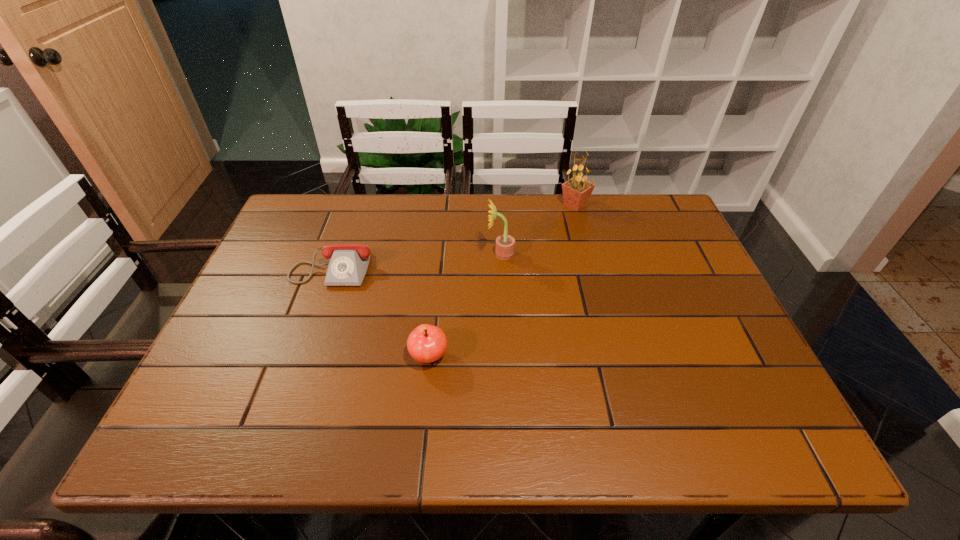
The image size is (960, 540). In order to click on free space at the right edge of the desktop in this screenshot , I will do `click(657, 308)`.

Find the location of a particular element. The height and width of the screenshot is (540, 960). vacant area at the far left corner of the desktop is located at coordinates (323, 204).

Identify the location of vacant space at the near left corner of the desktop. (180, 435).

The width and height of the screenshot is (960, 540). In the image, there is a desktop. Identify the location of vacant space at the far right corner. (639, 193).

The image size is (960, 540). In the image, there is a desktop. What are the coordinates of `vacant space at the near right corner` in the screenshot? It's located at (752, 407).

The image size is (960, 540). I want to click on free area in between the farther sunflower and the telephone, so click(454, 234).

Locate an element on the screen. free space between the third object from left to right and the nearest object is located at coordinates (x=465, y=305).

Image resolution: width=960 pixels, height=540 pixels. I want to click on vacant area between the telephone and the farthest object, so click(x=454, y=234).

Locate an element on the screen. vacant space in between the shortest object and the farther sunflower is located at coordinates 454,234.

Where is `vacant space that is in between the telephone and the second object from left to right`? This screenshot has width=960, height=540. vacant space that is in between the telephone and the second object from left to right is located at coordinates (381, 310).